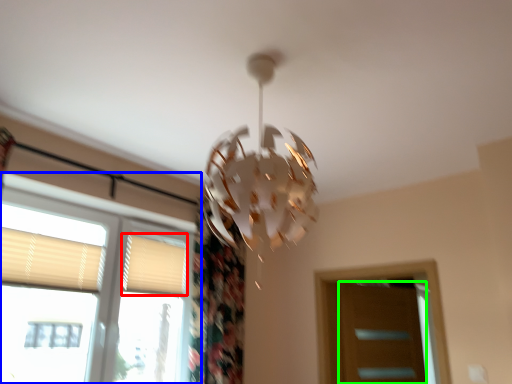
Question: Which object is the closest to the shutter (highlighted by a red box)? Choose among these: window (highlighted by a blue box) or screen door (highlighted by a green box).

Choices:
 (A) window
 (B) screen door

Answer: (A)